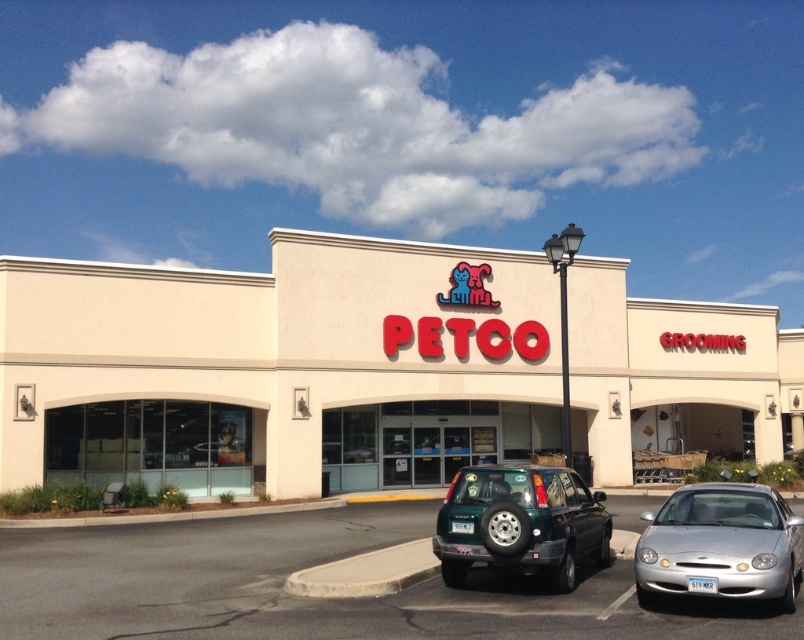
Question: Is beige/smooth building at center further to camera compared to metallic gray car at center?

Choices:
 (A) no
 (B) yes

Answer: (B)

Question: Which object is closer to the camera taking this photo?

Choices:
 (A) beige/smooth building at center
 (B) silver metallic car at lower right

Answer: (B)

Question: Which of the following is the farthest from the observer?

Choices:
 (A) (636, 529)
 (B) (544, 291)
 (C) (396, 476)
 (D) (466, 524)

Answer: (B)

Question: Does metallic gray car at center come in front of green matte car at center?

Choices:
 (A) yes
 (B) no

Answer: (A)

Question: Is metallic gray car at center closer to camera compared to green matte suv at center?

Choices:
 (A) yes
 (B) no

Answer: (A)

Question: Which point appears closest to the camera in this image?

Choices:
 (A) (659, 580)
 (B) (442, 371)
 (C) (40, 612)

Answer: (A)